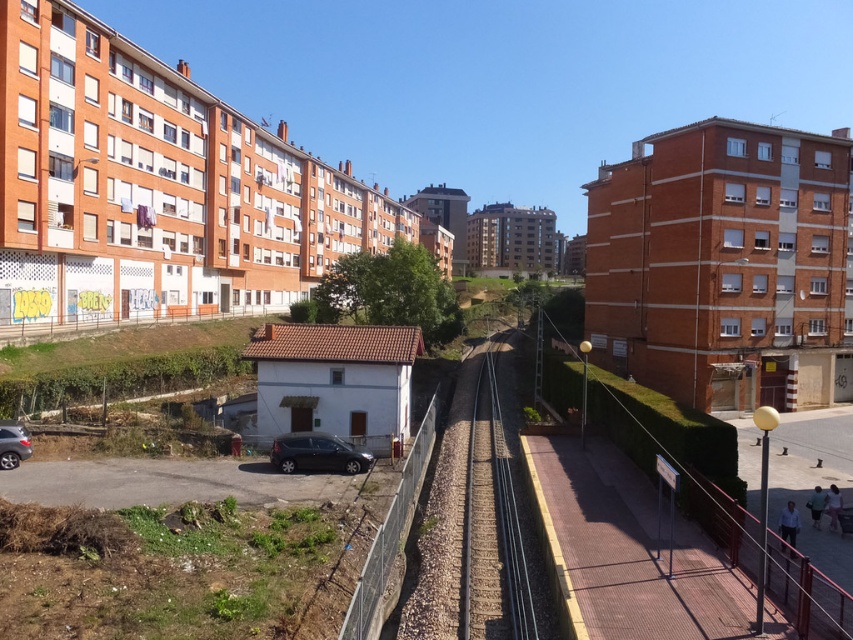
Question: From the image, what is the correct spatial relationship of brown gravel train track at center in relation to satin black car at lower center?

Choices:
 (A) right
 (B) left

Answer: (A)

Question: Which object is positioned farthest from the brown gravel train track at center?

Choices:
 (A) matte black car at lower left
 (B) satin black car at lower center

Answer: (A)

Question: Where is satin black car at lower center located in relation to matte black car at lower left in the image?

Choices:
 (A) above
 (B) below

Answer: (B)

Question: Which of the following is the farthest from the observer?

Choices:
 (A) satin black car at lower center
 (B) brown gravel train track at center
 (C) matte black car at lower left

Answer: (A)

Question: Can you confirm if brown gravel train track at center is positioned below matte black car at lower left?

Choices:
 (A) no
 (B) yes

Answer: (B)

Question: Which of the following is the farthest from the observer?

Choices:
 (A) (486, 374)
 (B) (13, 435)
 (C) (329, 470)

Answer: (A)